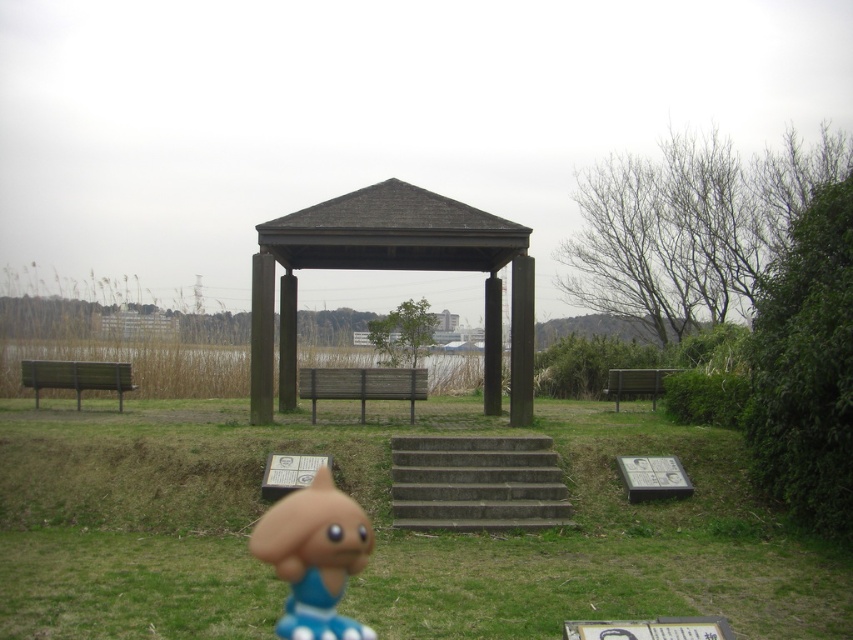
You are standing at the center of the image and want to place a new decorative item exactly at the point marked by the coordinates point (392, 269). According to the scene description, where would this point be located?

The point (392, 269) is on the brown wood gazebo at center, so placing the decorative item there would position it directly on the gazebo structure.

You are a photographer setting up a shot of the pavilion. You want to position your camera so that the matte orange toy at lower center is in the foreground and the pavilion is clearly visible in the background. Given their distance apart, can you frame both elements in a single shot without moving the toy or the pavilion?

The matte orange toy at lower center and the pavilion are 12.49 feet apart. Since this distance is manageable within a standard camera shot, you can frame both elements in a single shot without moving either object.